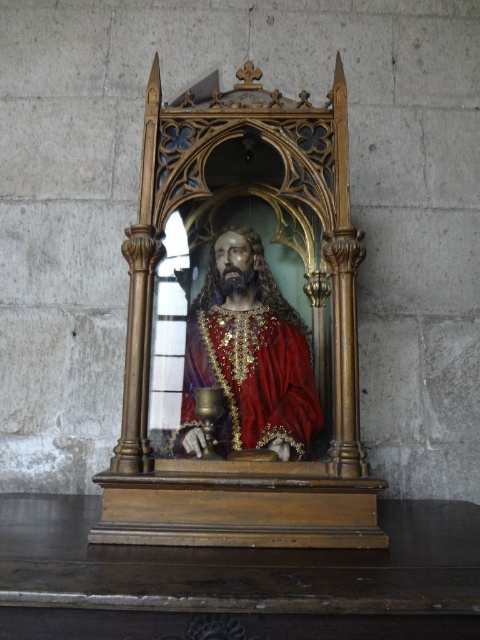
Between point (337, 144) and point (240, 406), which one is positioned behind?

The point (240, 406) is behind.

In the scene shown: Does wooden statue at center appear under shiny gold statue at center?

No, wooden statue at center is not below shiny gold statue at center.

Consider the image. Who is more distant from viewer, (320, 461) or (264, 369)?

Point (264, 369)

I want to click on wooden statue at center, so click(x=247, y=339).